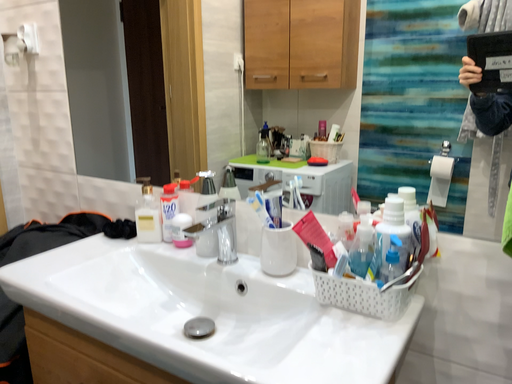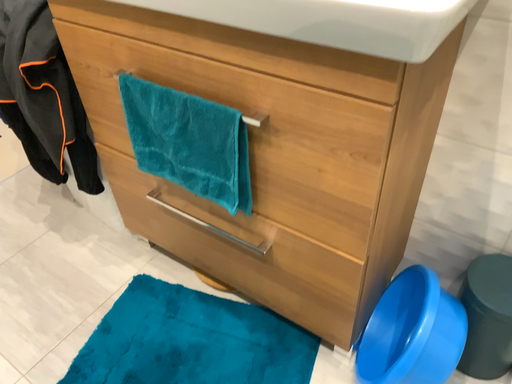
Question: Which way did the camera rotate in the video?

Choices:
 (A) rotated upward
 (B) rotated downward

Answer: (B)